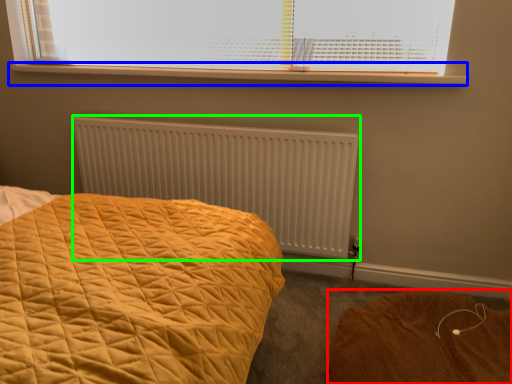
Question: Based on their relative distances, which object is nearer to plain (highlighted by a red box)? Choose from window sill (highlighted by a blue box) and radiator (highlighted by a green box).

Choices:
 (A) window sill
 (B) radiator

Answer: (B)